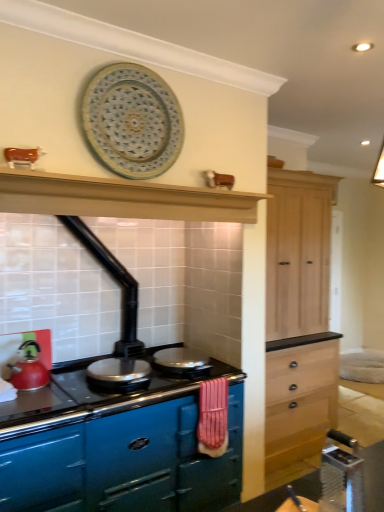
Where is `free spot to the right of matte red kettle at left`? The image size is (384, 512). free spot to the right of matte red kettle at left is located at coordinates (63, 387).